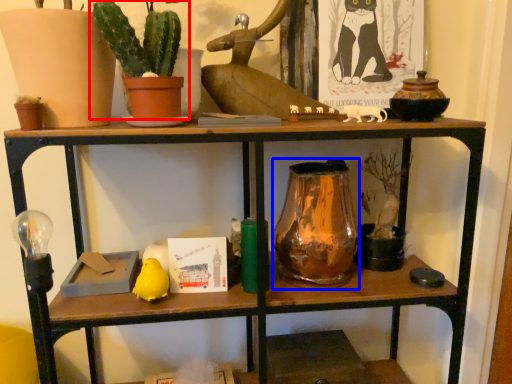
Question: Which point is closer to the camera, houseplant (highlighted by a red box) or glass vase (highlighted by a blue box)?

Choices:
 (A) houseplant
 (B) glass vase

Answer: (A)